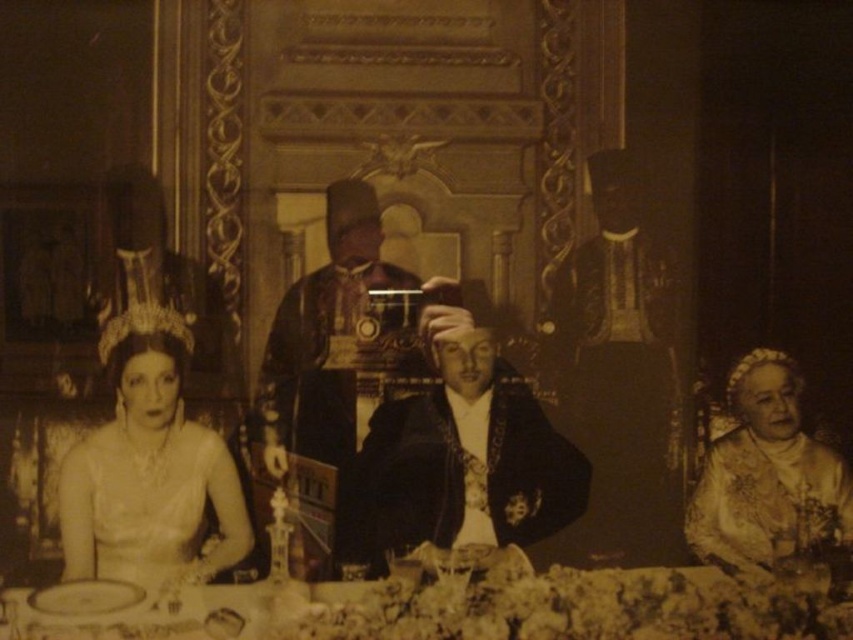
You are a photographer analyzing this historical image. You notice two items at the center of the table between the gold embroidered dress at center and the smooth leather jacket at center. Based on their positions, which item is closer to the edge of the table?

The gold embroidered dress at center is closer to the edge of the table because it is shorter than the smooth leather jacket at center, meaning it occupies less space and is positioned nearer to the table edge.

In the photograph, there are two white items on the left side of the table. The first is a white lace tiara at upper left and the second is a white satin dress at left. Which one is positioned further to the right?

The white satin dress at left is positioned further to the right compared to the white lace tiara at upper left.